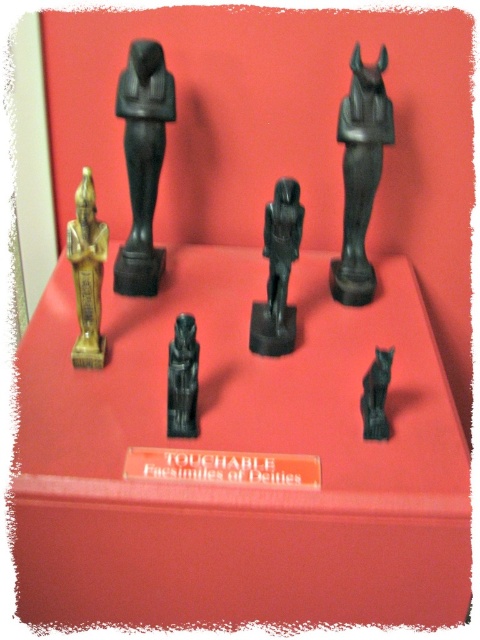
Between point (76, 364) and point (383, 433), which one is positioned behind?

The point (76, 364) is behind.

Describe the element at coordinates (86, 273) in the screenshot. I see `gold polished statue at left` at that location.

Which is behind, point (86, 312) or point (370, 435)?

The point (86, 312) is more distant.

At what (x,y) coordinates should I click in order to perform the action: click on gold polished statue at left. Please return your answer as a coordinate pair (x, y). The width and height of the screenshot is (480, 640). Looking at the image, I should click on (86, 273).

Can you confirm if black polished statue at center is wider than gold polished statue at left?

Correct, the width of black polished statue at center exceeds that of gold polished statue at left.

Between black polished statue at center and gold polished statue at left, which one has less height?

Standing shorter between the two is black polished statue at center.

You are a GUI agent. You are given a task and a screenshot of the screen. Output one action in this format:
    pyautogui.click(x=<x>, y=<y>)
    Task: Click on the black polished statue at center
    This screenshot has height=640, width=480.
    Given the screenshot: What is the action you would take?
    pyautogui.click(x=277, y=273)

Locate an element on the screen. Image resolution: width=480 pixels, height=640 pixels. black polished statue at center is located at coordinates (277, 273).

Can you confirm if matte black statue at center is positioned to the right of black glossy statue at upper left?

Indeed, matte black statue at center is positioned on the right side of black glossy statue at upper left.

This screenshot has width=480, height=640. Describe the element at coordinates (240, 449) in the screenshot. I see `matte black statue at center` at that location.

Which is in front, point (46, 464) or point (132, 243)?

Point (46, 464) is more forward.

Where is `matte black statue at center`? Image resolution: width=480 pixels, height=640 pixels. matte black statue at center is located at coordinates (240, 449).